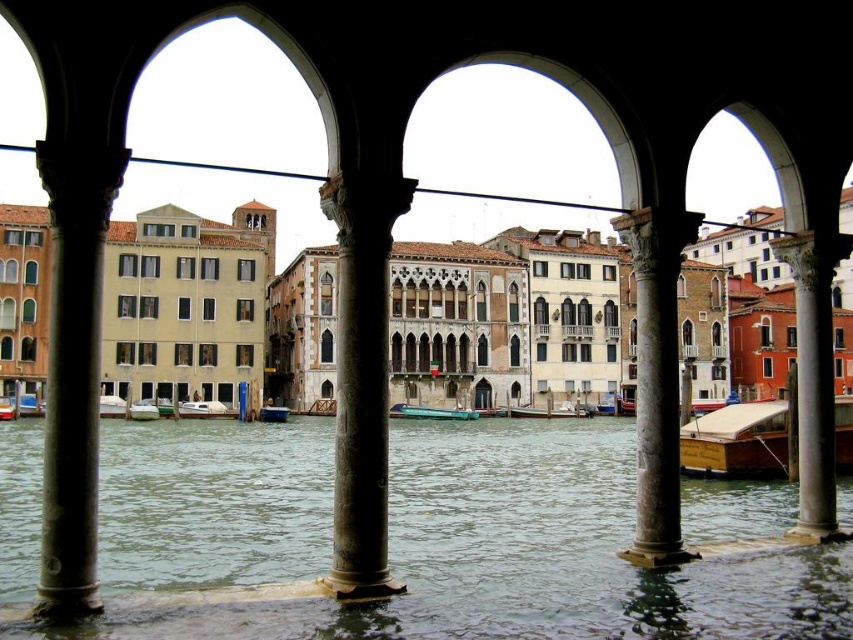
Does clear water at center have a greater height compared to metallic blue boat at center?

Indeed, clear water at center has a greater height compared to metallic blue boat at center.

Who is lower down, clear water at center or metallic blue boat at center?

Positioned lower is clear water at center.

Describe the element at coordinates (537, 554) in the screenshot. The height and width of the screenshot is (640, 853). I see `clear water at center` at that location.

This screenshot has width=853, height=640. Find the location of `clear water at center`. clear water at center is located at coordinates (537, 554).

Between clear water at center and wooden polished boat at center, which one appears on the left side from the viewer's perspective?

From the viewer's perspective, clear water at center appears more on the left side.

The height and width of the screenshot is (640, 853). Describe the element at coordinates (537, 554) in the screenshot. I see `clear water at center` at that location.

Is point (440, 596) farther from viewer compared to point (569, 412)?

No, it is not.

Where is `clear water at center`? The image size is (853, 640). clear water at center is located at coordinates (537, 554).

Is wooden polished boat at right thinner than metallic blue boat at center?

No.

Can you confirm if wooden polished boat at right is positioned to the right of metallic blue boat at center?

Indeed, wooden polished boat at right is positioned on the right side of metallic blue boat at center.

Who is more distant from viewer, (695, 424) or (273, 419)?

The point (273, 419) is behind.

Find the location of a particular element. The image size is (853, 640). wooden polished boat at right is located at coordinates (735, 440).